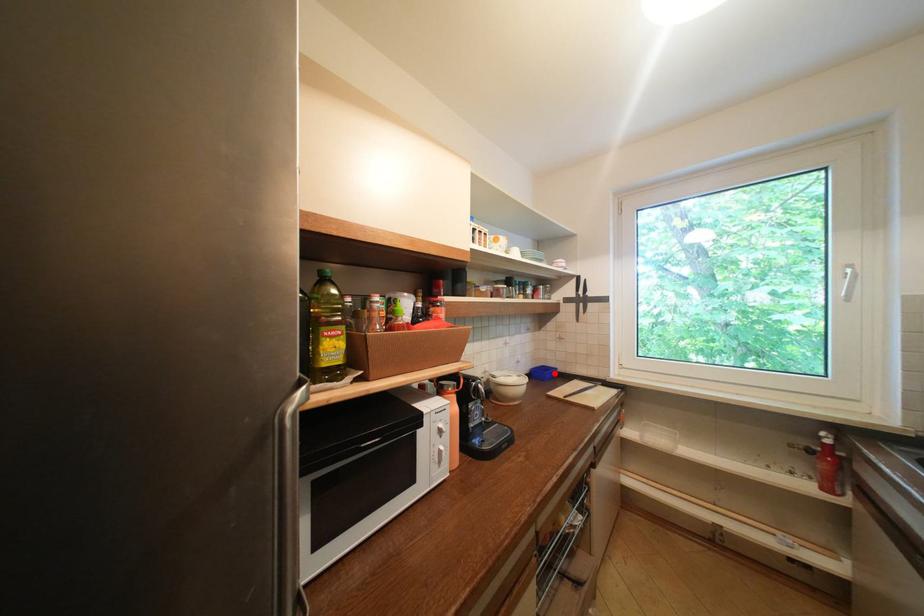
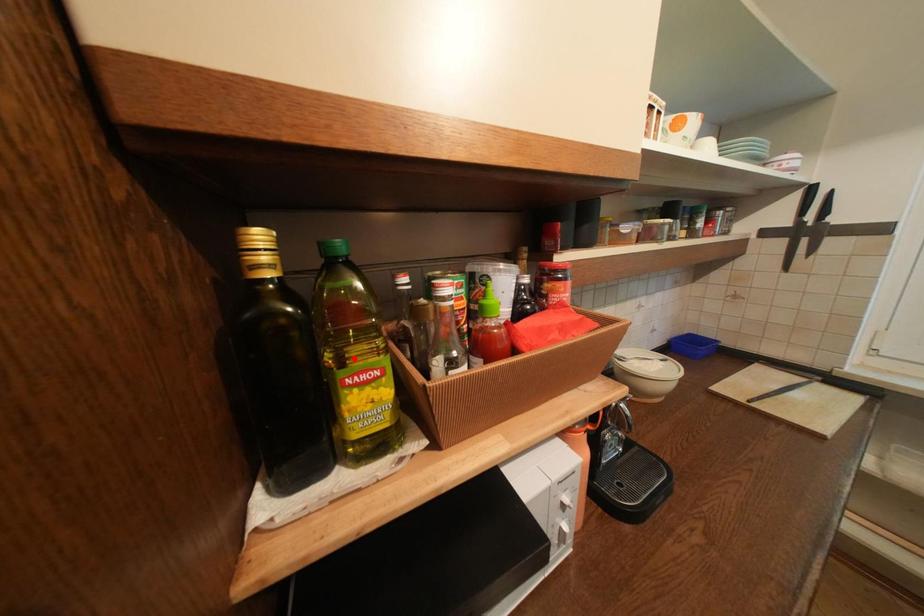
I am providing you with two images of the same scene from different viewpoints. A red point is marked on the first image and another point is marked on the second image. Is the marked point in image1 the same physical position as the marked point in image2?

No